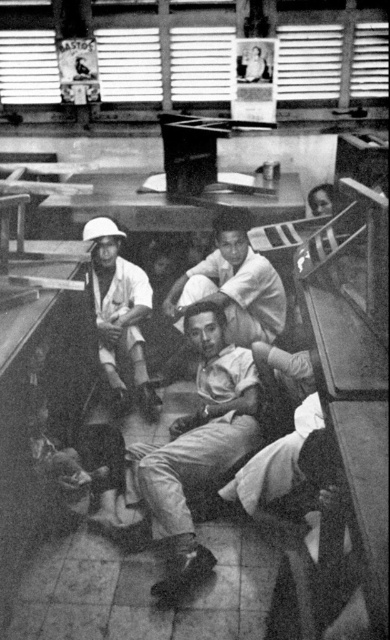
Can you confirm if matte white shirt at center is shorter than matte white helmet at upper left?

Indeed, matte white shirt at center has a lesser height compared to matte white helmet at upper left.

Based on the photo, who is lower down, matte white shirt at center or matte white helmet at upper left?

matte white shirt at center is below.

Which is behind, point (184, 448) or point (88, 298)?

The point (88, 298) is behind.

Locate an element on the screen. Image resolution: width=390 pixels, height=640 pixels. matte white shirt at center is located at coordinates (196, 448).

Measure the distance between point (200,397) and camera.

Point (200,397) and camera are 4.20 meters apart from each other.

Is matte white shirt at center in front of smooth skin man at center?

That is True.

Is point (182, 426) behind point (257, 308)?

That is False.

At what (x,y) coordinates should I click in order to perform the action: click on matte white shirt at center. Please return your answer as a coordinate pair (x, y). This screenshot has width=390, height=640. Looking at the image, I should click on (196, 448).

Can you confirm if smooth skin man at center is wider than matte white helmet at upper left?

Correct, the width of smooth skin man at center exceeds that of matte white helmet at upper left.

Who is more distant from viewer, (244, 298) or (111, 291)?

The point (111, 291) is behind.

Locate an element on the screen. This screenshot has height=640, width=390. smooth skin man at center is located at coordinates (232, 285).